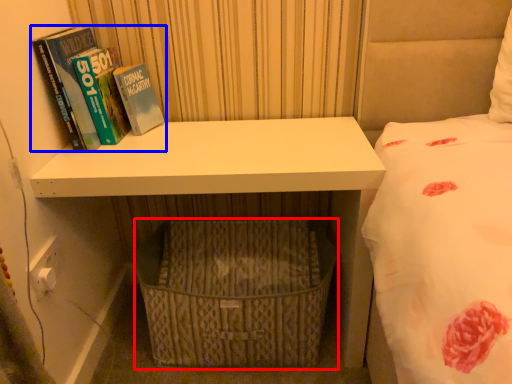
Question: Which of the following is the closest to the observer, basket (highlighted by a red box) or book (highlighted by a blue box)?

Choices:
 (A) basket
 (B) book

Answer: (B)